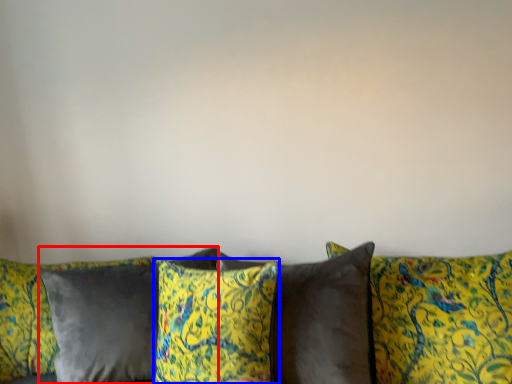
Question: Which object is closer to the camera taking this photo, pillow (highlighted by a red box) or pillow (highlighted by a blue box)?

Choices:
 (A) pillow
 (B) pillow

Answer: (B)